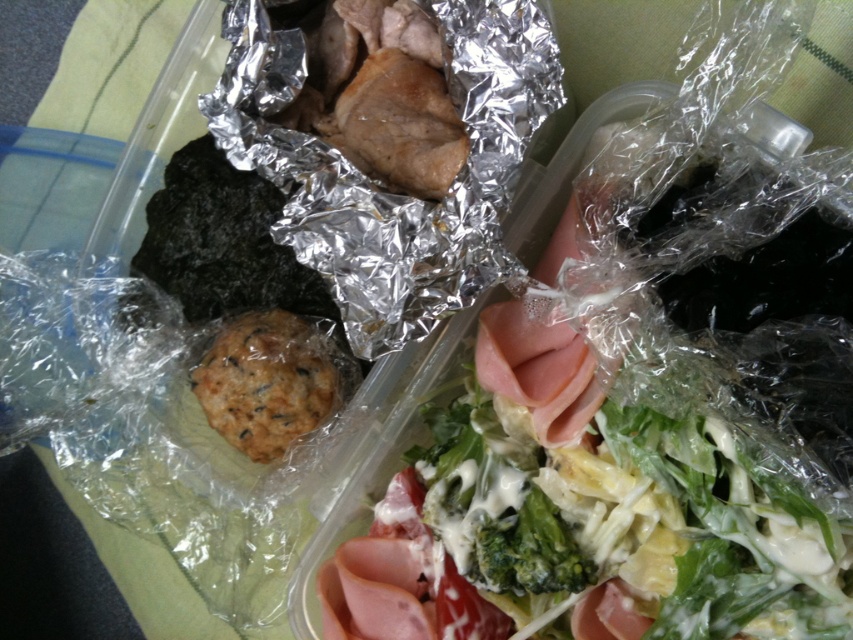
You are organizing a picnic and have this meal container. You want to place the green leafy salad at upper right and the green matte broccoli at center into a cooler. Which one should you put first to ensure the broccoli stays fresh longer?

The green leafy salad at upper right is above the green matte broccoli at center in the container. Since the broccoli is lower, it might be cooler already, but to ensure freshness, place the broccoli first in the cooler to keep it at the bottom where it stays colder longer.

You are a delivery person standing 30 inches away from the container. Can you reach the point located at coordinates point (439, 595) without moving closer?

The distance of point (439, 595) from viewer is 33.55 inches, so you are 3 inches too far to reach it without moving closer.